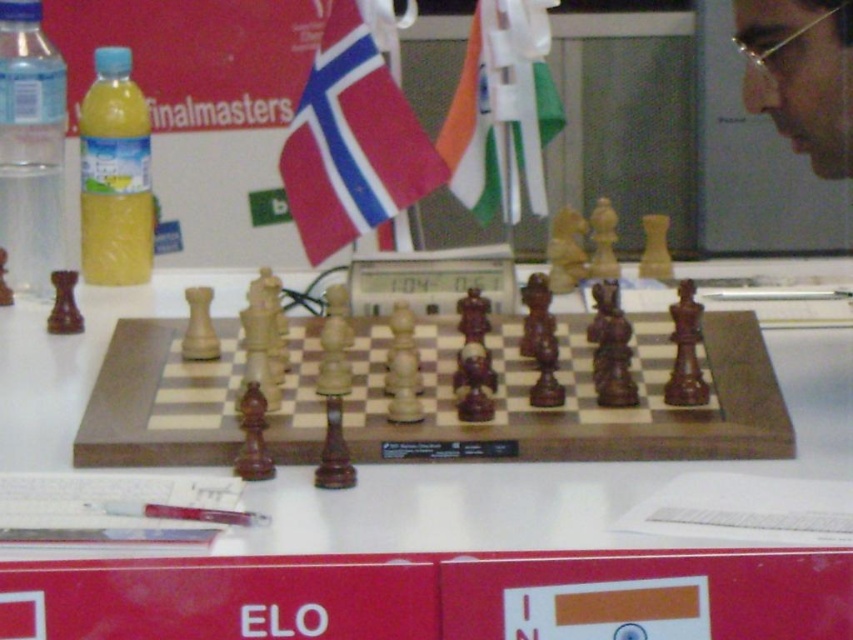
Is white fabric flag at center to the right of clear plastic bottle at left from the viewer's perspective?

Correct, you'll find white fabric flag at center to the right of clear plastic bottle at left.

From the picture: Does white fabric flag at center appear over clear plastic bottle at left?

Correct, white fabric flag at center is located above clear plastic bottle at left.

Identify the location of white fabric flag at center. (502, 109).

How far apart are white fabric flag at center and yellow translucent bottle at left?

white fabric flag at center and yellow translucent bottle at left are 20.58 inches apart from each other.

Does white fabric flag at center have a lesser width compared to yellow translucent bottle at left?

In fact, white fabric flag at center might be wider than yellow translucent bottle at left.

Is point (498, 141) less distant than point (119, 176)?

No, it is not.

Locate an element on the screen. white fabric flag at center is located at coordinates (502, 109).

Which is more to the left, clear plastic bottle at left or yellow translucent bottle at left?

From the viewer's perspective, clear plastic bottle at left appears more on the left side.

Measure the distance between clear plastic bottle at left and yellow translucent bottle at left.

clear plastic bottle at left is 2.87 inches away from yellow translucent bottle at left.

Is point (9, 1) positioned before point (103, 154)?

Yes.

At what (x,y) coordinates should I click in order to perform the action: click on clear plastic bottle at left. Please return your answer as a coordinate pair (x, y). The height and width of the screenshot is (640, 853). Looking at the image, I should click on (30, 148).